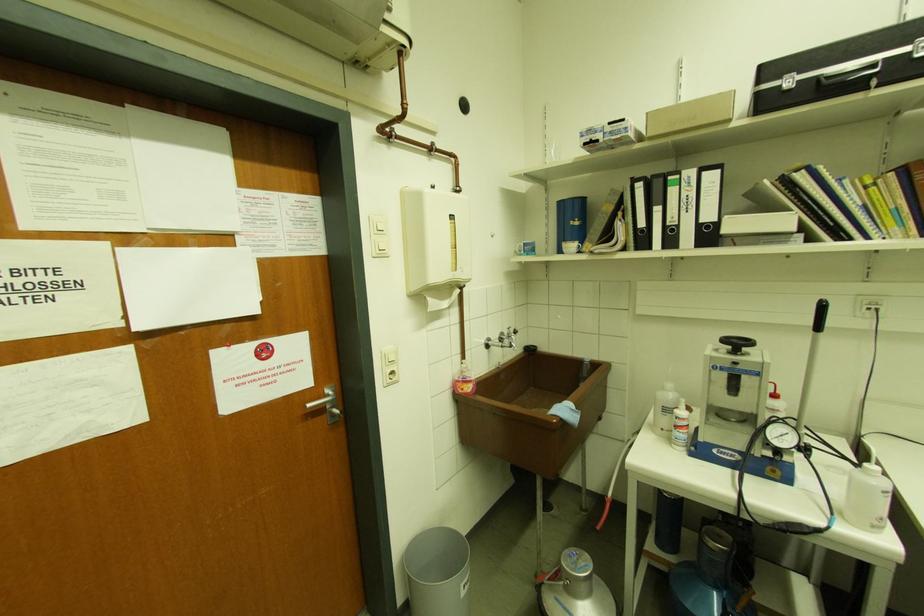
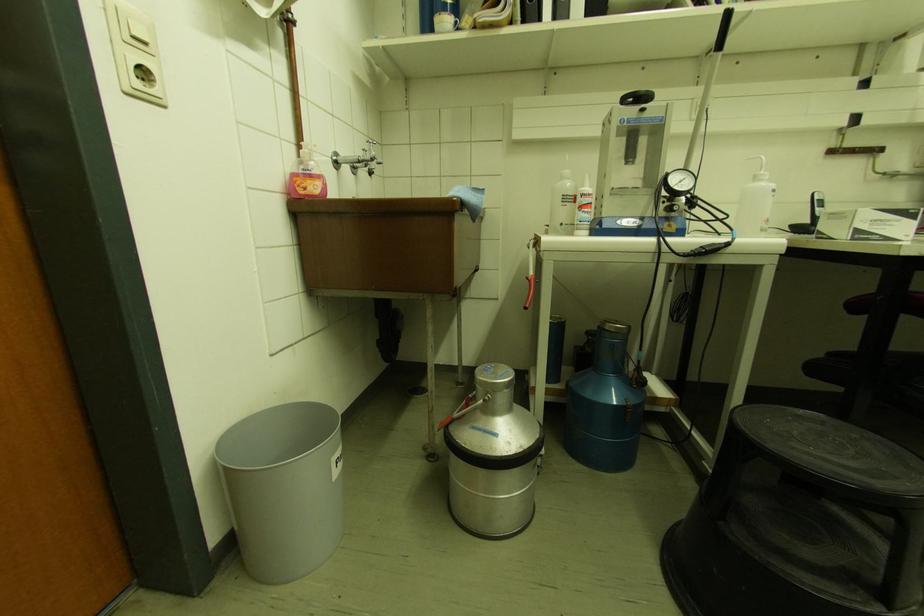
In the second image, find the point that corresponds to point (687, 408) in the first image.

(590, 185)